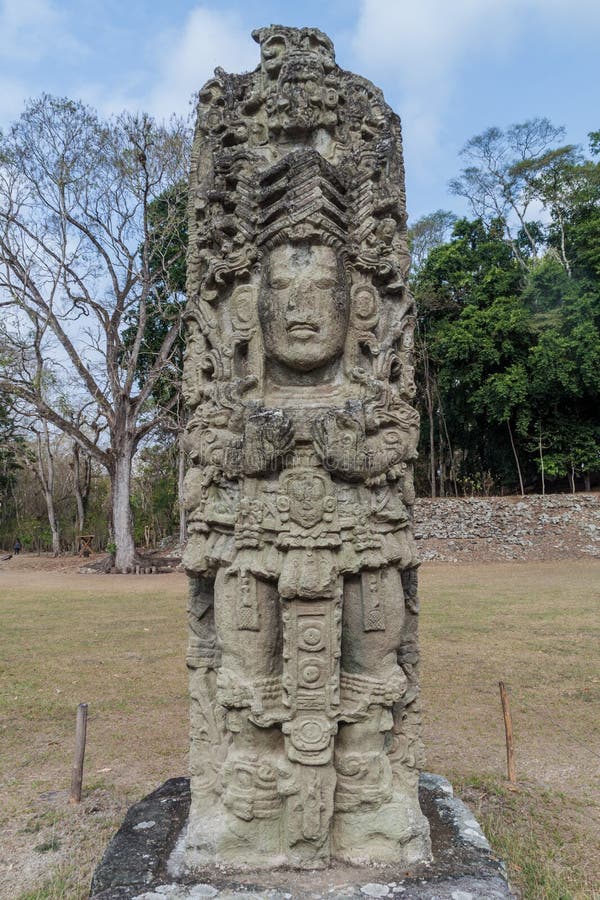
Locate an element on the screen. Image resolution: width=600 pixels, height=900 pixels. statue hand is located at coordinates (338, 445), (338, 780), (273, 438).